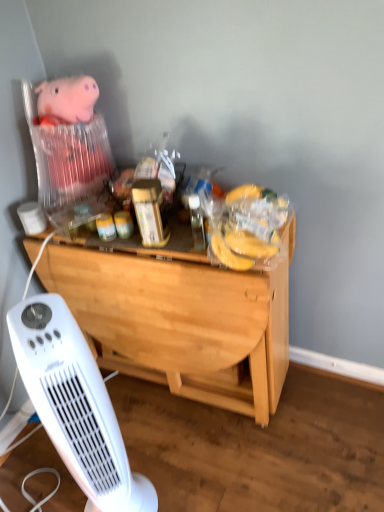
Locate an element on the screen. This screenshot has height=512, width=384. free space in front of light wood desk at center is located at coordinates (211, 458).